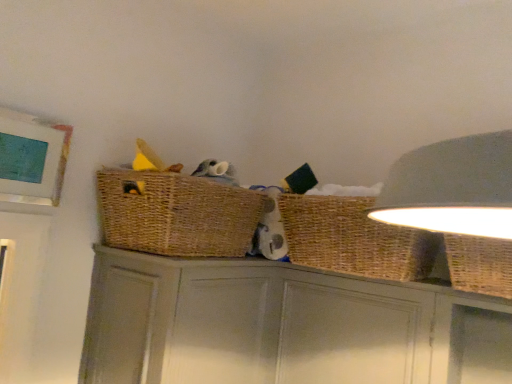
Question: Does point (157, 241) appear closer or farther from the camera than point (339, 369)?

Choices:
 (A) farther
 (B) closer

Answer: (B)

Question: From their relative heights in the image, would you say woven brown basket at upper center is taller or shorter than matte gray cabinet at center?

Choices:
 (A) tall
 (B) short

Answer: (B)

Question: Which of these objects is positioned farthest from the woven wicker basket at upper right, acting as the second basket starting from the left?

Choices:
 (A) woven wicker basket at right, which is the second basket in right-to-left order
 (B) matte gray cabinet at center
 (C) woven brown basket at upper center

Answer: (C)

Question: Estimate the real-world distances between objects in this image. Which object is farther from the woven brown basket at upper center?

Choices:
 (A) woven wicker basket at right, which is the second basket in right-to-left order
 (B) woven wicker basket at upper right, which is counted as the first basket, starting from the right
 (C) matte gray cabinet at center

Answer: (B)